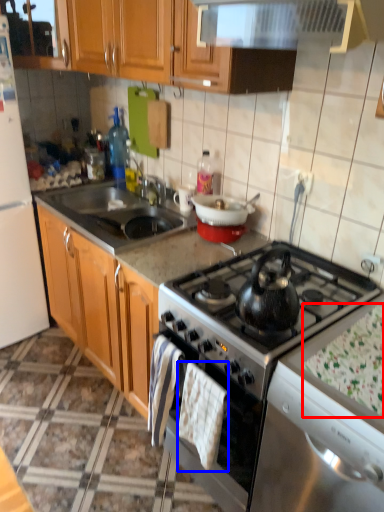
Question: Which of the following is the closest to the observer, food (highlighted by a red box) or hand towel (highlighted by a blue box)?

Choices:
 (A) food
 (B) hand towel

Answer: (A)